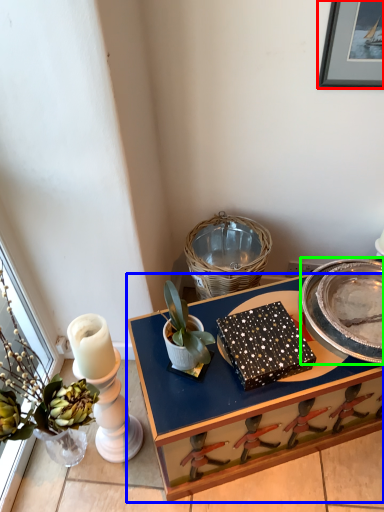
Question: Considering the real-world distances, which object is farthest from picture frame (highlighted by a red box)? desk (highlighted by a blue box) or plate (highlighted by a green box)?

Choices:
 (A) desk
 (B) plate

Answer: (A)